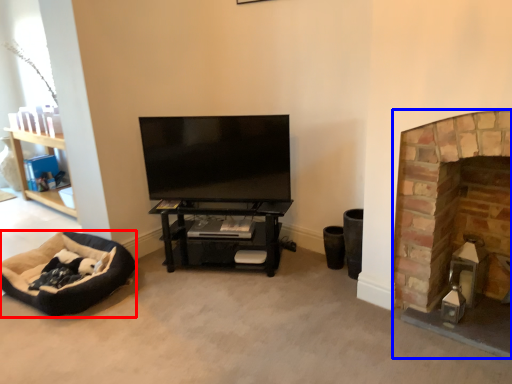
Question: Among these objects, which one is nearest to the camera, dog bed (highlighted by a red box) or fireplace (highlighted by a blue box)?

Choices:
 (A) dog bed
 (B) fireplace

Answer: (B)